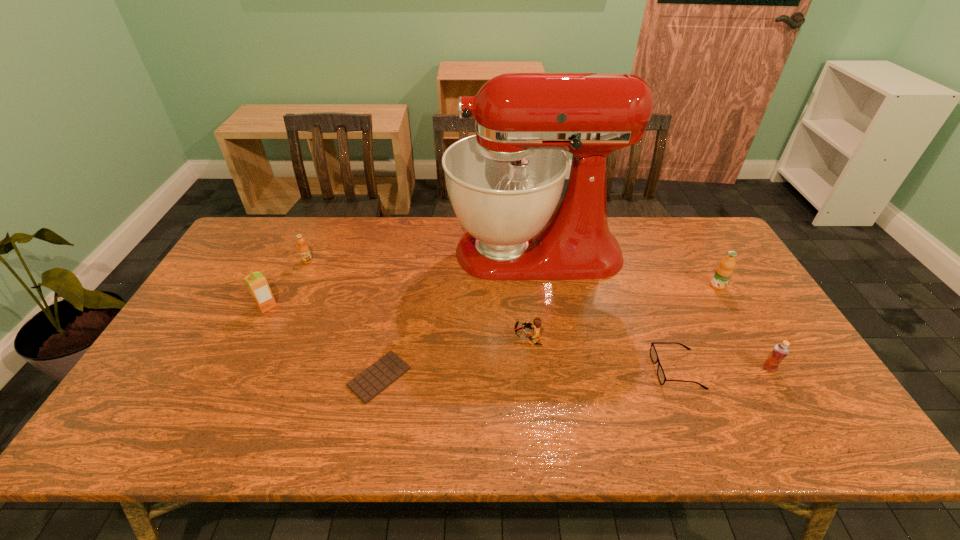
You are a GUI agent. You are given a task and a screenshot of the screen. Output one action in this format:
    pyautogui.click(x=<x>, y=<y>)
    Task: Click on the object that is the seventh nearest to the second nearest orange juice
    
    Given the screenshot: What is the action you would take?
    pyautogui.click(x=781, y=350)

Locate which orange juice ranks third in proximity to the third nearest orange juice. Please provide its 2D coordinates. Your answer should be formatted as a tuple, i.e. [(x, y)], where the tuple contains the x and y coordinates of a point satisfying the conditions above.

[(256, 282)]

In order to click on orange juice that is the third closest one to the third object from left to right in this screenshot , I will do coord(781,350).

The height and width of the screenshot is (540, 960). Identify the location of free point that satisfies the following two spatial constraints: 1. at the attachment hub of the nearest orange juice; 2. on the right side of the tallest object. (551, 368).

Where is `vacant region that satisfies the following two spatial constraints: 1. on the label of the nearest orange juice; 2. on the left side of the second farthest orange juice`? The image size is (960, 540). vacant region that satisfies the following two spatial constraints: 1. on the label of the nearest orange juice; 2. on the left side of the second farthest orange juice is located at coordinates (765, 368).

Where is `free space that satisfies the following two spatial constraints: 1. at the attachment hub of the mixer; 2. on the back side of the nearest orange juice`? The image size is (960, 540). free space that satisfies the following two spatial constraints: 1. at the attachment hub of the mixer; 2. on the back side of the nearest orange juice is located at coordinates (551, 368).

The width and height of the screenshot is (960, 540). I want to click on free space that satisfies the following two spatial constraints: 1. on the back side of the nearest orange juice; 2. on the right side of the chocolate bar, so click(x=381, y=368).

The image size is (960, 540). I want to click on free spot that satisfies the following two spatial constraints: 1. on the label of the nearest orange juice; 2. on the right side of the third nearest orange juice, so click(765, 368).